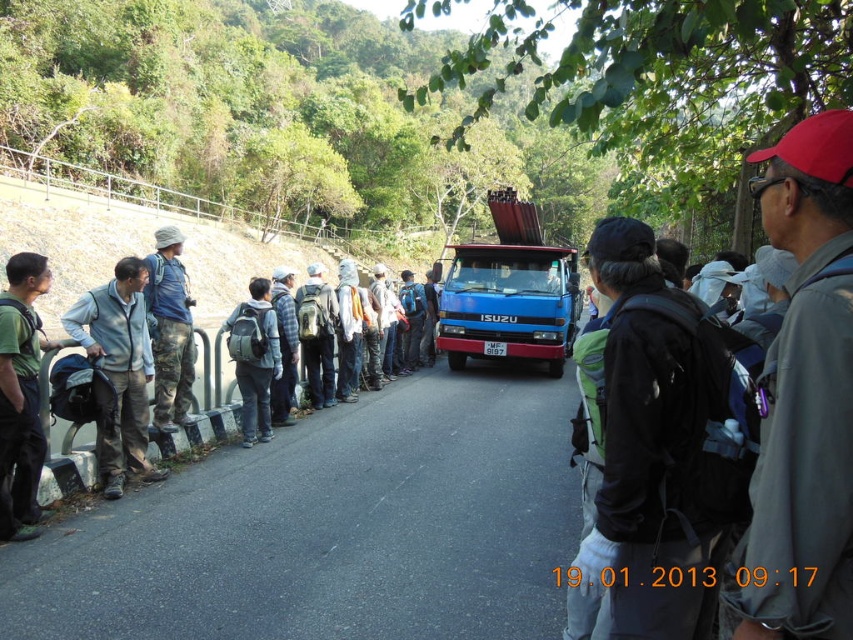
Can you confirm if gray fabric jacket at right is bigger than blue metallic truck at center?

Yes, gray fabric jacket at right is bigger than blue metallic truck at center.

Is gray fabric jacket at right shorter than blue metallic truck at center?

No.

Is point (757, 525) positioned after point (570, 285)?

No, it is not.

At what (x,y) coordinates should I click in order to perform the action: click on gray fabric jacket at right. Please return your answer as a coordinate pair (x, y). Looking at the image, I should click on (805, 397).

Does black backpack at center have a smaller size compared to blue metallic truck at center?

No.

Is black backpack at center positioned behind blue metallic truck at center?

No.

Does point (596, 260) come behind point (549, 348)?

No, it is not.

Where is `black backpack at center`? This screenshot has width=853, height=640. black backpack at center is located at coordinates (660, 449).

Who is higher up, blue metallic truck at center or light gray fleece jacket at left?

blue metallic truck at center is above.

Consider the image. Is blue metallic truck at center bigger than light gray fleece jacket at left?

Actually, blue metallic truck at center might be smaller than light gray fleece jacket at left.

Identify the location of blue metallic truck at center. (509, 305).